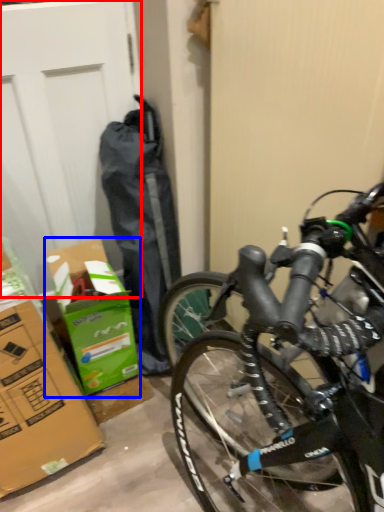
Question: Which object is further to the camera taking this photo, garage door (highlighted by a red box) or cardboard box (highlighted by a blue box)?

Choices:
 (A) garage door
 (B) cardboard box

Answer: (B)